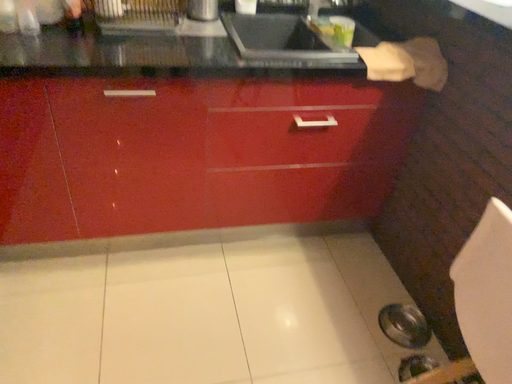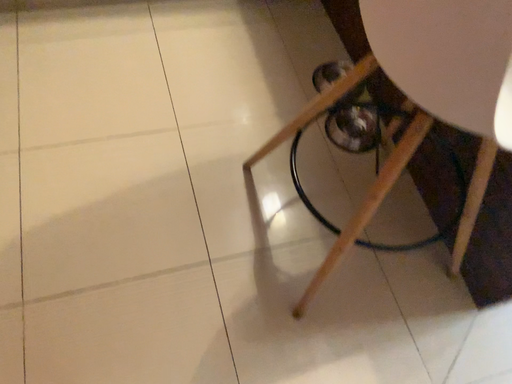
Question: Which way did the camera rotate in the video?

Choices:
 (A) rotated upward
 (B) rotated downward

Answer: (B)